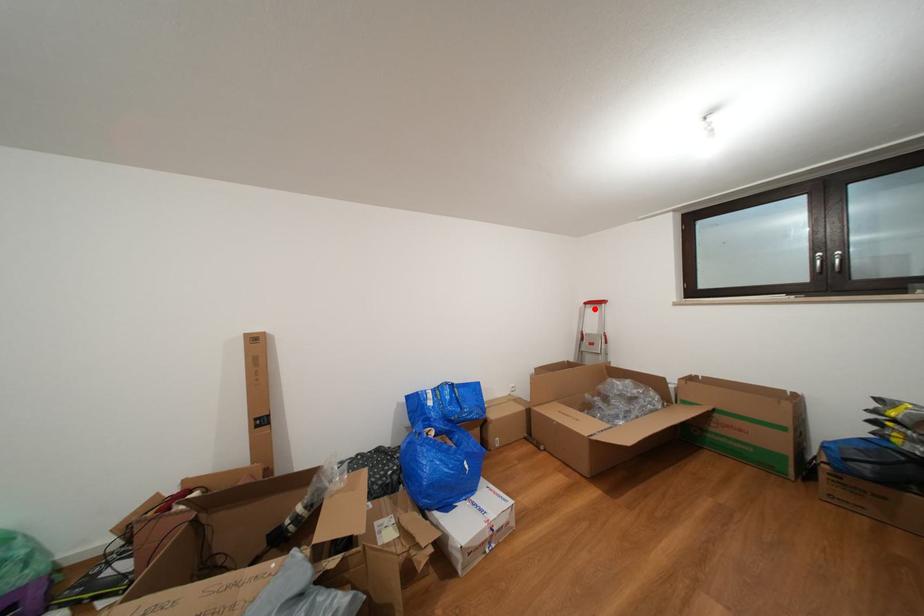
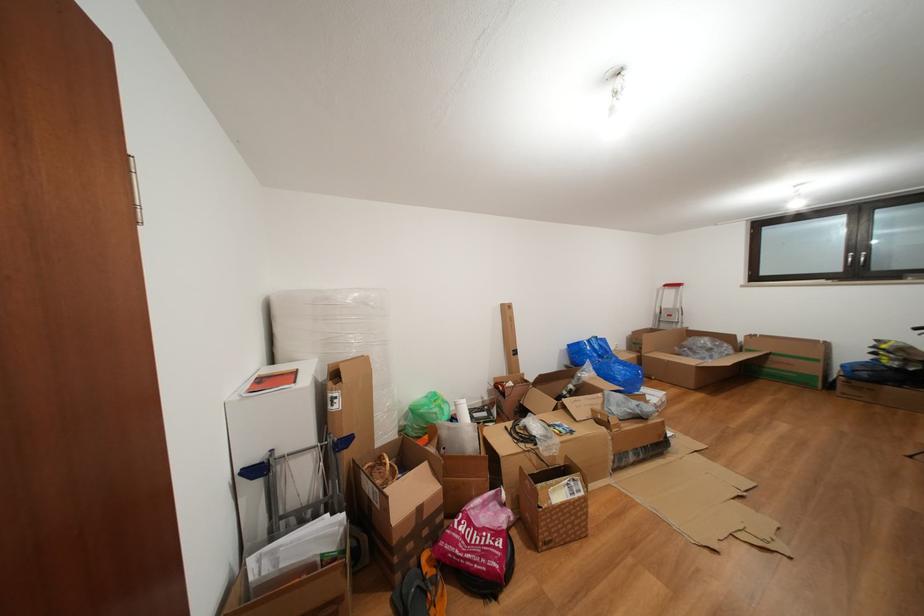
In the second image, find the point that corresponds to the highlighted location in the first image.

(674, 291)